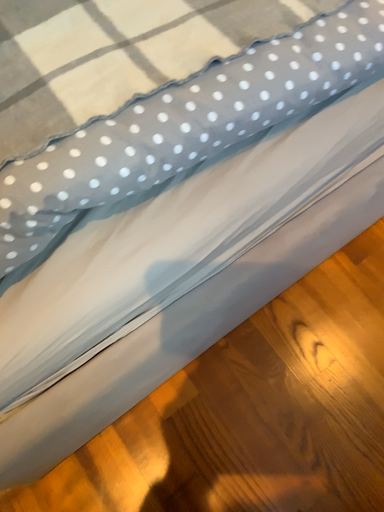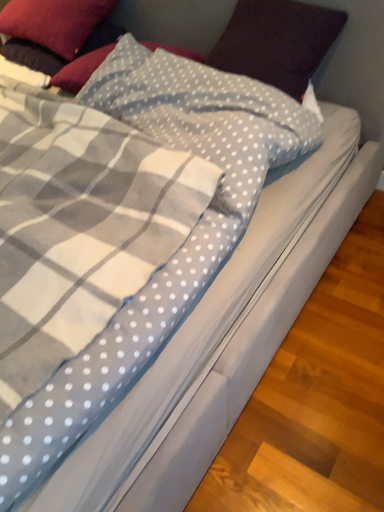
Question: How did the camera likely rotate when shooting the video?

Choices:
 (A) rotated left
 (B) rotated right

Answer: (B)